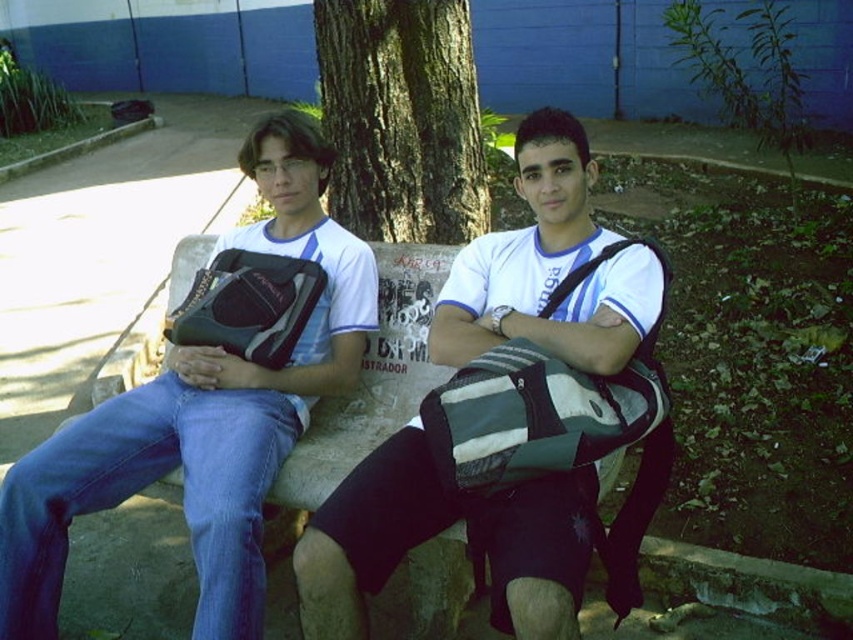
You are a hiker who wants to hang a small backpack organizer on the matte black bag at left or the green rough bark tree at center. Which object is taller and thus more suitable for hanging the organizer higher?

The matte black bag at left is much taller than the green rough bark tree at center, so it is more suitable for hanging the organizer higher.

You are a delivery drone with a package that requires a 1.2 meter clearance between the matte black backpack at center and the green rough bark tree at center to land safely. Can you land between them?

The distance between the matte black backpack at center and the green rough bark tree at center is 1.15 meters, which is less than the required 1.2 meters. Therefore, you cannot safely land between them.

You are a photographer trying to capture a photo of the green rough bark tree at center without including the matte black bag at left in the frame. Based on their positions, is this possible?

The matte black bag at left is to the left of the green rough bark tree at center, so by positioning the camera to the right side of the matte black bag at left, you can exclude it from the frame and capture the green rough bark tree at center alone.